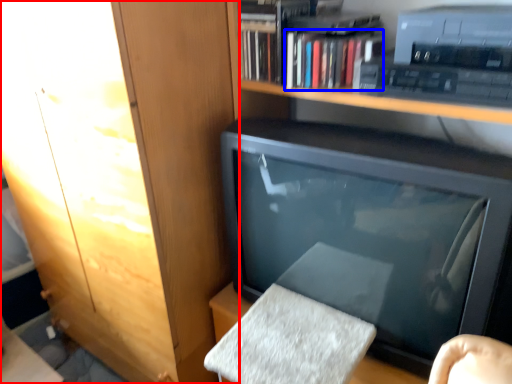
Question: Which point is closer to the camera, cabinetry (highlighted by a red box) or book (highlighted by a blue box)?

Choices:
 (A) cabinetry
 (B) book

Answer: (A)